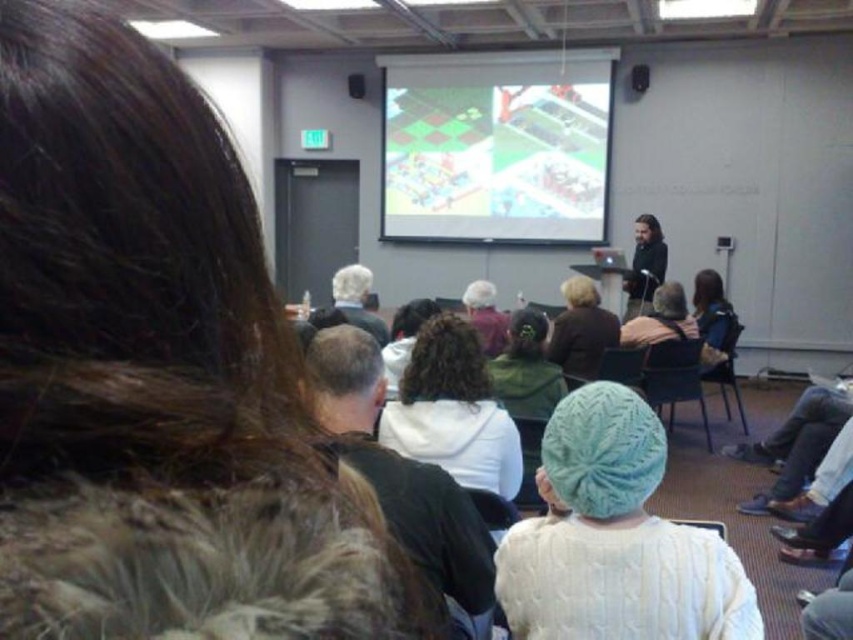
Can you confirm if dark brown sweater at center is positioned to the right of curly hair at center?

Indeed, dark brown sweater at center is positioned on the right side of curly hair at center.

Can you confirm if dark brown sweater at center is thinner than curly hair at center?

Incorrect, dark brown sweater at center's width is not less than curly hair at center's.

Locate an element on the screen. This screenshot has height=640, width=853. dark brown sweater at center is located at coordinates (581, 330).

Who is more distant from viewer, (363,292) or (734,348)?

Point (734,348)

Based on the photo, does gray hair at center have a lesser width compared to dark gray plastic chair at center?

Indeed, gray hair at center has a lesser width compared to dark gray plastic chair at center.

Which is behind, point (372, 336) or point (733, 371)?

Point (733, 371)

Identify the location of gray hair at center. (357, 300).

Who is more forward, (639,262) or (733,364)?

Positioned in front is point (639,262).

Does dark brown hair at center appear over dark gray plastic chair at center?

Yes, dark brown hair at center is above dark gray plastic chair at center.

Between point (663, 266) and point (730, 337), which one is positioned in front?

Positioned in front is point (730, 337).

Identify the location of dark brown hair at center. (643, 266).